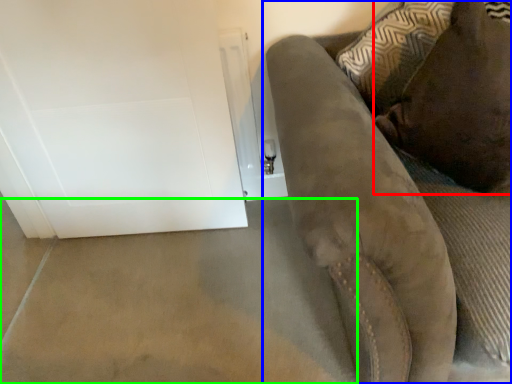
Question: Which object is positioned farthest from pillow (highlighted by a red box)? Select from furniture (highlighted by a blue box) and concrete (highlighted by a green box).

Choices:
 (A) furniture
 (B) concrete

Answer: (B)